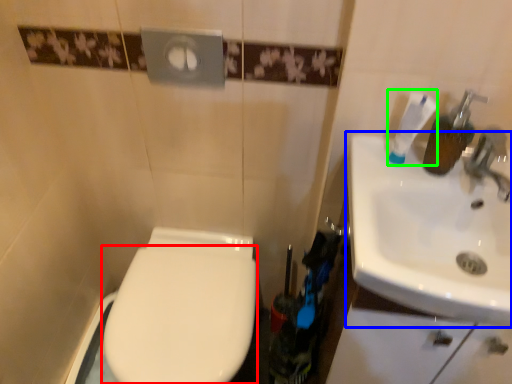
Question: Considering the real-world distances, which object is closest to bidet (highlighted by a red box)? sink (highlighted by a blue box) or toothpaste (highlighted by a green box).

Choices:
 (A) sink
 (B) toothpaste

Answer: (A)